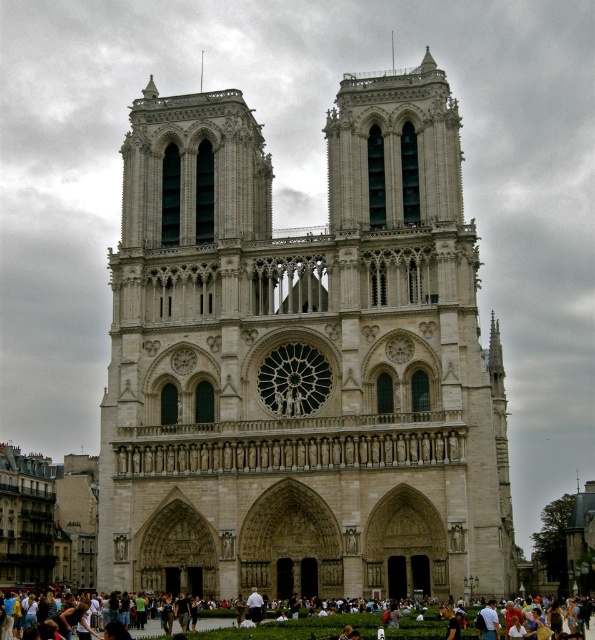
Who is taller, white stone church at center or light brown leather bag at lower center?

white stone church at center

Is white stone church at center to the left of light brown leather bag at lower center from the viewer's perspective?

Incorrect, white stone church at center is not on the left side of light brown leather bag at lower center.

Is point (500, 572) behind point (239, 636)?

Yes, point (500, 572) is farther from viewer.

Find the location of a particular element. white stone church at center is located at coordinates (302, 360).